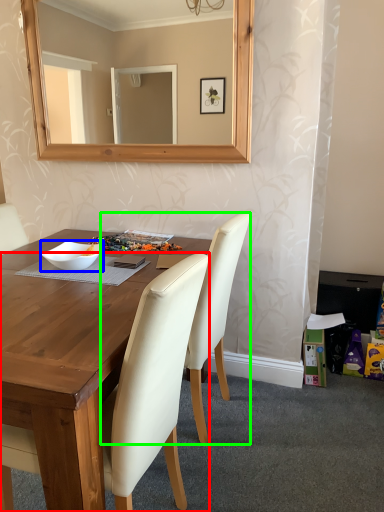
Question: Which is farther away from chair (highlighted by a red box)? bowl (highlighted by a blue box) or chair (highlighted by a green box)?

Choices:
 (A) bowl
 (B) chair

Answer: (A)